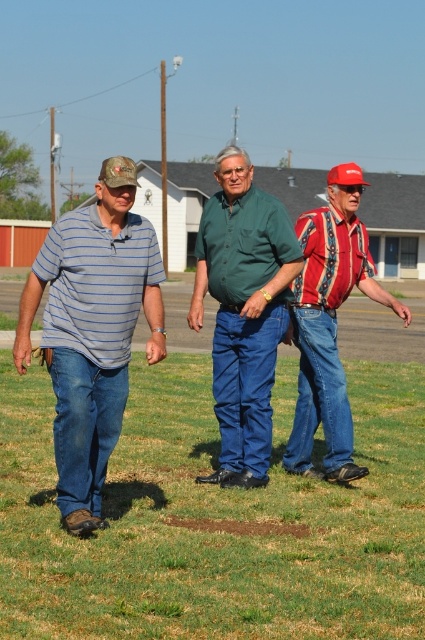
Between green grass at center and green cotton shirt at center, which one is positioned higher?

green cotton shirt at center

Can you confirm if green grass at center is taller than green cotton shirt at center?

Incorrect, green grass at center's height is not larger of green cotton shirt at center's.

Image resolution: width=425 pixels, height=640 pixels. Describe the element at coordinates (215, 518) in the screenshot. I see `green grass at center` at that location.

Where is `green grass at center`? The image size is (425, 640). green grass at center is located at coordinates (215, 518).

Who is positioned more to the left, striped cotton shirt at left or red plaid shirt at center?

From the viewer's perspective, striped cotton shirt at left appears more on the left side.

Can you confirm if striped cotton shirt at left is positioned to the right of red plaid shirt at center?

In fact, striped cotton shirt at left is to the left of red plaid shirt at center.

Is point (73, 406) positioned after point (299, 403)?

No, (73, 406) is in front of (299, 403).

Identify the location of striped cotton shirt at left. (93, 330).

Does green cotton shirt at center have a lesser height compared to red plaid shirt at center?

Incorrect, green cotton shirt at center's height does not fall short of red plaid shirt at center's.

Is point (218, 301) behind point (337, 260)?

No, it is not.

Where is `green cotton shirt at center`? This screenshot has width=425, height=640. green cotton shirt at center is located at coordinates (243, 310).